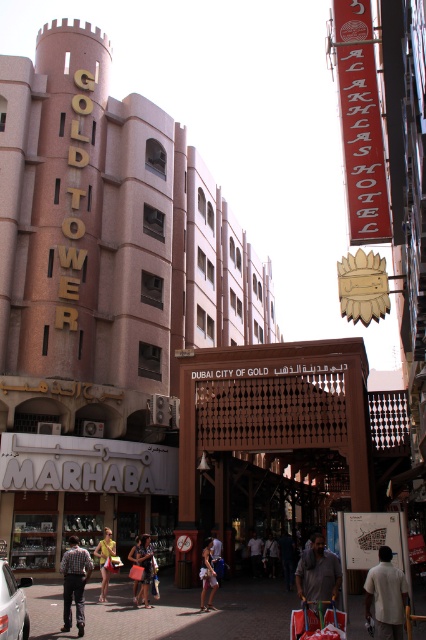
Question: Which object is farther from the camera taking this photo?

Choices:
 (A) pink textured building at upper left
 (B) white cotton dress at center
 (C) dark blue jeans at center
 (D) dark gray fabric shirt at center

Answer: (C)

Question: Is denim shorts at center closer to camera compared to dark blue shirt at center?

Choices:
 (A) yes
 (B) no

Answer: (A)

Question: Which of the following is the farthest from the observer?

Choices:
 (A) (313, 595)
 (B) (66, 259)

Answer: (B)

Question: Is white cotton dress at center further to camera compared to matte pink dress at center?

Choices:
 (A) no
 (B) yes

Answer: (A)

Question: Is dark gray fabric shirt at center below striped shirt at center?

Choices:
 (A) yes
 (B) no

Answer: (B)

Question: Which is farther from the dark gray fabric shirt at center?

Choices:
 (A) yellow fabric dress at center
 (B) white cotton dress at center

Answer: (A)